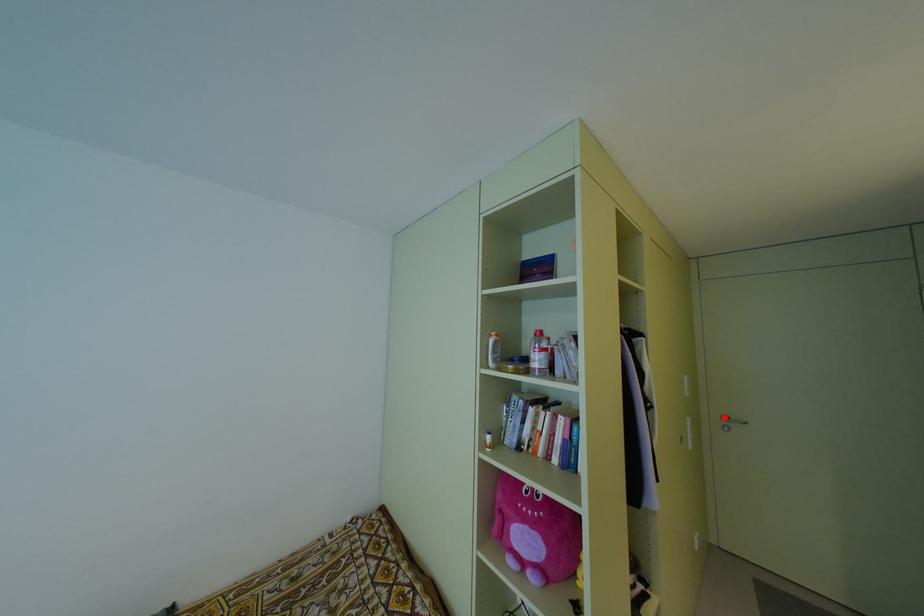
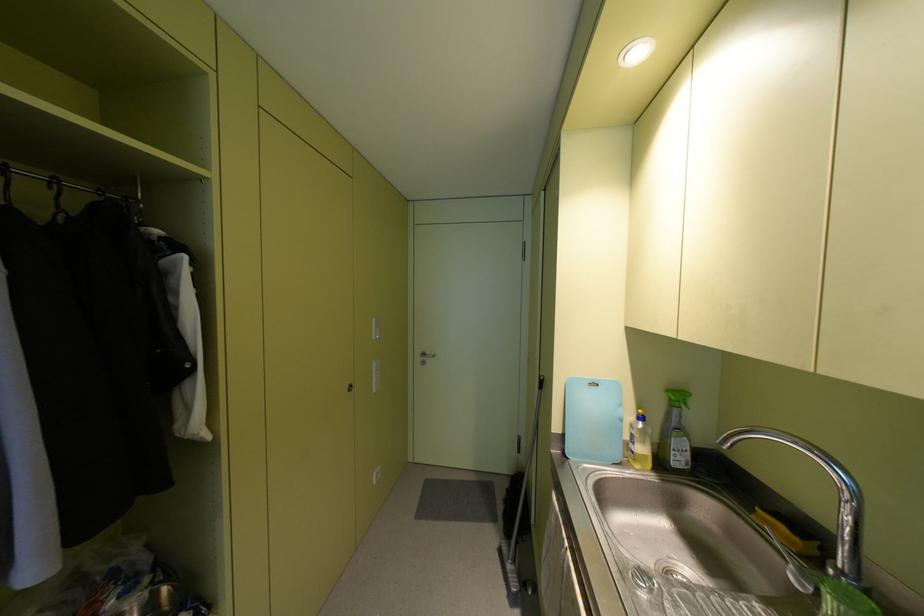
The point at the highlighted location is marked in the first image. Where is the corresponding point in the second image?

(422, 354)